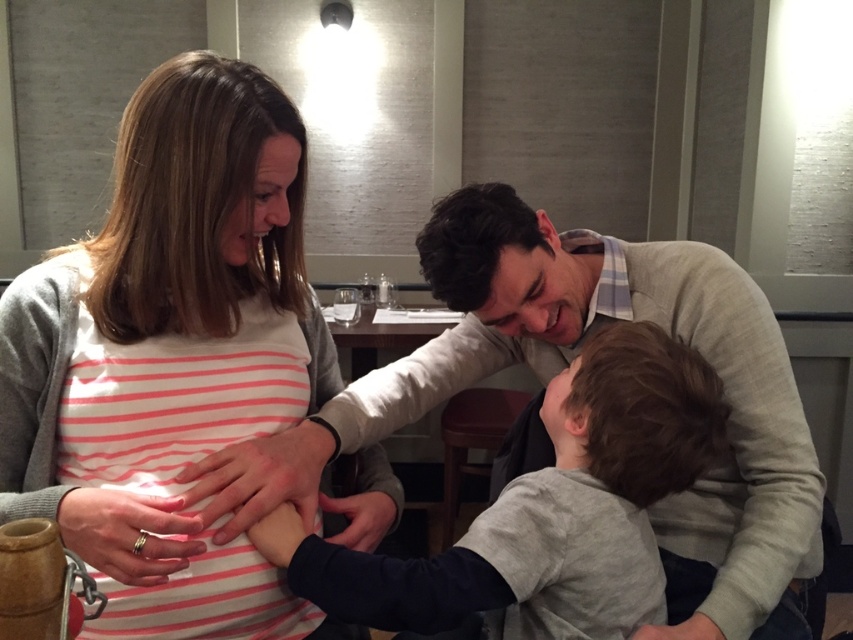
Question: Estimate the real-world distances between objects in this image. Which object is farther from the pink striped shirt at center?

Choices:
 (A) silver metallic ring at center
 (B) gray cotton shirt at center

Answer: (B)

Question: Is matte skin hand at center further to camera compared to silver metallic ring at center?

Choices:
 (A) yes
 (B) no

Answer: (A)

Question: Can you confirm if gray cotton shirt at center is positioned to the right of matte skin hand at center?

Choices:
 (A) yes
 (B) no

Answer: (A)

Question: Considering the real-world distances, which object is closest to the silver metallic ring at center?

Choices:
 (A) matte black hand at center
 (B) matte skin hand at center
 (C) gray cotton shirt at center
 (D) pink striped shirt at center

Answer: (B)

Question: Estimate the real-world distances between objects in this image. Which object is closer to the pink striped shirt at center?

Choices:
 (A) matte skin hand at center
 (B) matte black hand at center
 (C) gray cotton shirt at center
 (D) silver metallic ring at center

Answer: (A)

Question: Is gray cotton shirt at center thinner than silver metallic ring at center?

Choices:
 (A) yes
 (B) no

Answer: (B)